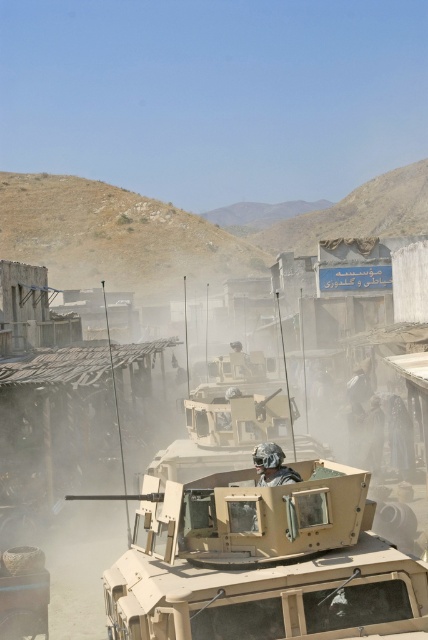
Question: Which point is farther to the camera?

Choices:
 (A) tan matte tank at center
 (B) camouflage helmet at center

Answer: (B)

Question: Does tan matte tank at center appear on the left side of camouflage helmet at center?

Choices:
 (A) yes
 (B) no

Answer: (A)

Question: Can you confirm if tan matte tank at center is positioned above camouflage helmet at center?

Choices:
 (A) no
 (B) yes

Answer: (A)

Question: Is tan matte tank at center positioned at the back of camouflage helmet at center?

Choices:
 (A) yes
 (B) no

Answer: (B)

Question: Which point is closer to the camera?

Choices:
 (A) camouflage helmet at center
 (B) tan matte tank at center

Answer: (B)